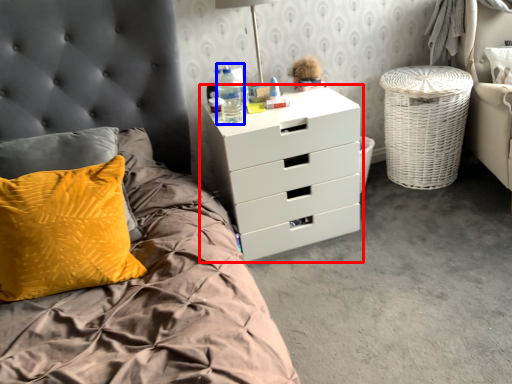
Question: Among these objects, which one is farthest to the camera, chest of drawers (highlighted by a red box) or bottle (highlighted by a blue box)?

Choices:
 (A) chest of drawers
 (B) bottle

Answer: (B)